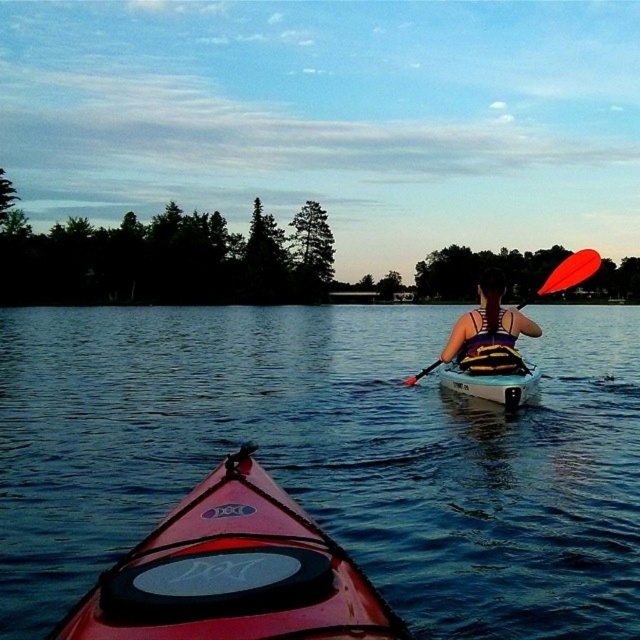
In the scene shown: Can you confirm if shiny red kayak at lower center is wider than orange paddle at upper right?

No.

Is point (156, 618) positioned in front of point (547, 288)?

Yes, point (156, 618) is in front of point (547, 288).

Does point (280, 497) lie behind point (579, 276)?

No, (280, 497) is closer to viewer.

The height and width of the screenshot is (640, 640). In order to click on shiny red kayak at lower center in this screenshot , I will do `click(234, 573)`.

Can you confirm if transparent water at center is wider than shiny red kayak at lower center?

Yes.

Does transparent water at center appear under shiny red kayak at lower center?

No.

Between point (595, 396) and point (244, 566), which one is positioned behind?

Positioned behind is point (595, 396).

Image resolution: width=640 pixels, height=640 pixels. Find the location of `transparent water at center`. transparent water at center is located at coordinates [x=330, y=456].

Which is more to the right, matte yellow life vest at center or white plastic canoe at center?

Positioned to the right is white plastic canoe at center.

Does matte yellow life vest at center appear over white plastic canoe at center?

Correct, matte yellow life vest at center is located above white plastic canoe at center.

The height and width of the screenshot is (640, 640). What are the coordinates of `matte yellow life vest at center` in the screenshot? It's located at (488, 333).

Locate an element on the screen. The image size is (640, 640). matte yellow life vest at center is located at coordinates (488, 333).